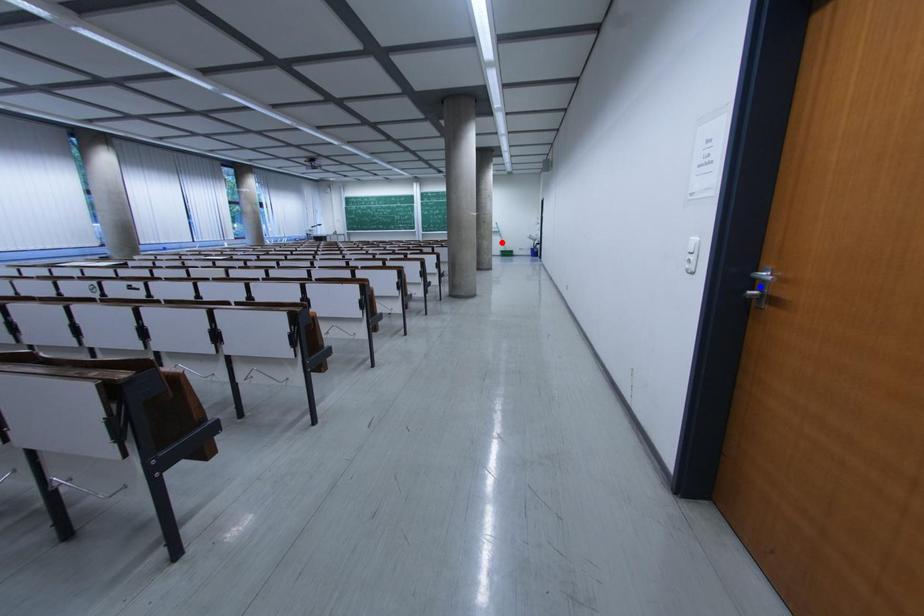
Question: Which of the two points in the image is closer to the camera?

Choices:
 (A) Blue point is closer.
 (B) Red point is closer.

Answer: (A)